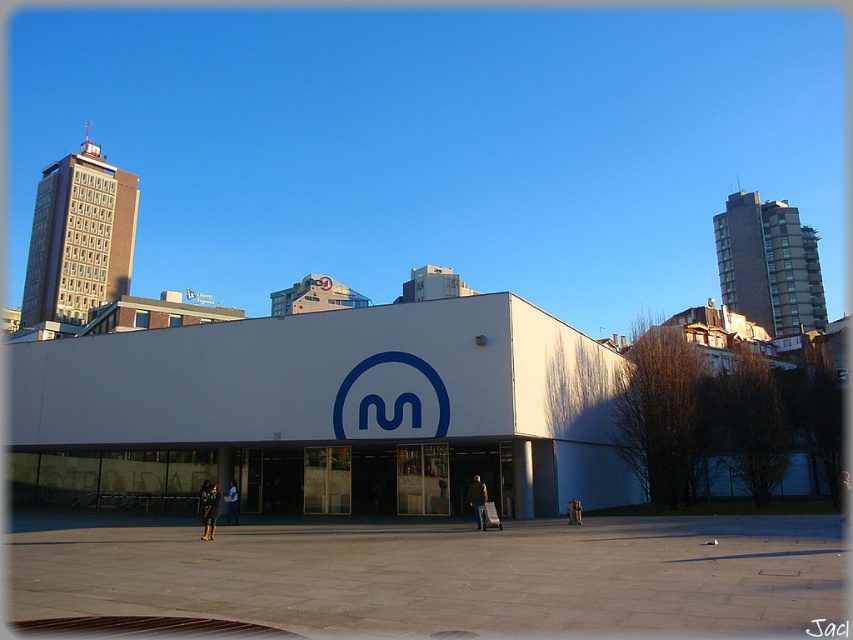
You are a photographer standing at the entrance of the metro station. You notice two jackets hanging on a rack in the center of the plaza. Which jacket is shorter in height between the light brown leather jacket at center and the dark green fabric jacket at center?

The light brown leather jacket at center is not as tall as the dark green fabric jacket at center, so the light brown leather jacket at center is shorter in height.

You are a photographer trying to capture the white smooth building at center and the dark blue leather jacket at center in the same frame. Based on their sizes in the image, which object would appear larger in your photo?

The white smooth building at center appears larger in the photo because it is taller than the dark blue leather jacket at center.